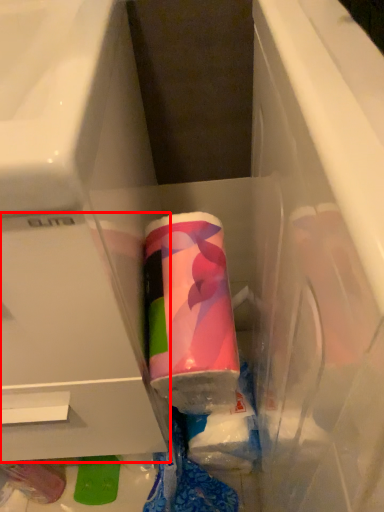
Question: From the image, what is the correct spatial relationship of drawer (annotated by the red box) in relation to toothpaste?

Choices:
 (A) right
 (B) left

Answer: (B)